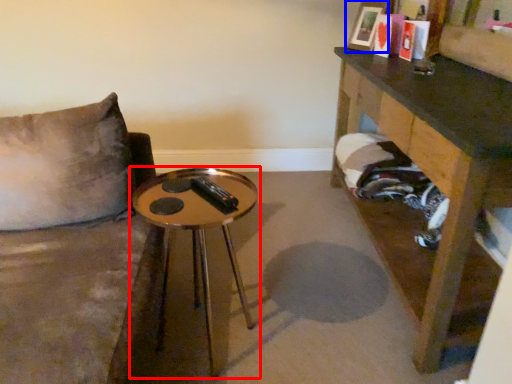
Question: Which point is closer to the camera, table (highlighted by a red box) or picture frame (highlighted by a blue box)?

Choices:
 (A) table
 (B) picture frame

Answer: (A)